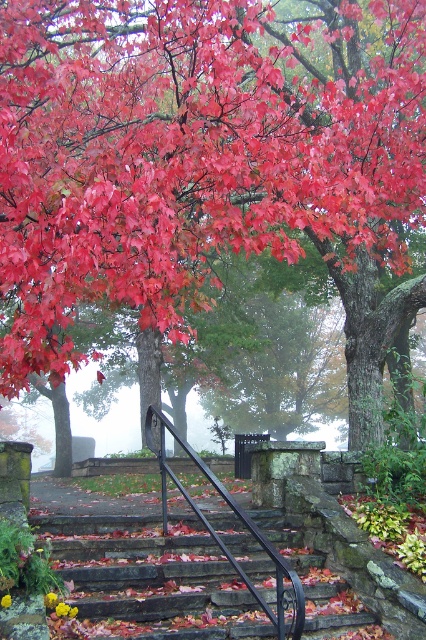
Question: Which point is closer to the camera?

Choices:
 (A) stone steps at center
 (B) black metal/rail at center

Answer: (B)

Question: Which point appears closest to the camera in this image?

Choices:
 (A) (114, 605)
 (B) (285, 564)

Answer: (B)

Question: Can you confirm if stone steps at center is thinner than black metal/rail at center?

Choices:
 (A) no
 (B) yes

Answer: (A)

Question: Can you confirm if stone steps at center is bigger than black metal/rail at center?

Choices:
 (A) no
 (B) yes

Answer: (A)

Question: Among these points, which one is nearest to the camera?

Choices:
 (A) (66, 632)
 (B) (216, 484)

Answer: (A)

Question: Is stone steps at center to the left of black metal/rail at center from the viewer's perspective?

Choices:
 (A) no
 (B) yes

Answer: (A)